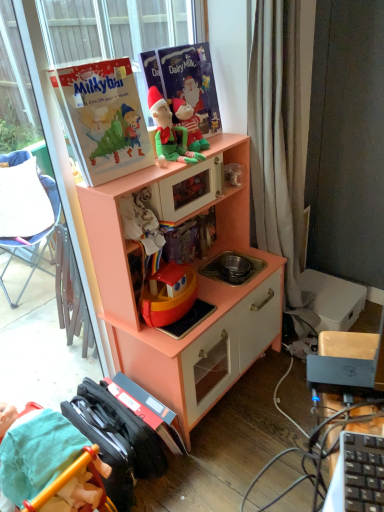
Question: From a real-world perspective, is smooth teal fabric at lower left, the 2th person in the top-to-bottom sequence, over green plush toy at upper center, which is counted as the second person, starting from the left?

Choices:
 (A) no
 (B) yes

Answer: (A)

Question: Can you see smooth teal fabric at lower left, which appears as the 1th person when ordered from the bottom, touching green plush toy at upper center, the 2th person from the bottom?

Choices:
 (A) no
 (B) yes

Answer: (A)

Question: Is smooth teal fabric at lower left, the 2th person viewed from the right, not inside green plush toy at upper center, which is counted as the second person, starting from the left?

Choices:
 (A) yes
 (B) no

Answer: (A)

Question: Is smooth teal fabric at lower left, which appears as the 1th person when ordered from the bottom, facing away from green plush toy at upper center, the 2th person from the bottom?

Choices:
 (A) no
 (B) yes

Answer: (A)

Question: Does smooth teal fabric at lower left, the 2th person in the top-to-bottom sequence, have a larger size compared to green plush toy at upper center, marked as the 1th person in a right-to-left arrangement?

Choices:
 (A) yes
 (B) no

Answer: (A)

Question: Is smooth teal fabric at lower left, which appears as the 1th person when ordered from the bottom, wider than green plush toy at upper center, which is counted as the second person, starting from the left?

Choices:
 (A) no
 (B) yes

Answer: (B)

Question: Is matte paperboard book at upper left, the 2th paperback book from the right, smaller than matte paper book at upper center, which is the second paperback book in left-to-right order?

Choices:
 (A) yes
 (B) no

Answer: (B)

Question: From the image's perspective, does matte paperboard book at upper left, arranged as the 1th paperback book when viewed from the left, appear higher than matte paper book at upper center, which is the second paperback book in left-to-right order?

Choices:
 (A) no
 (B) yes

Answer: (A)

Question: Is matte paperboard book at upper left, the 2th paperback book from the right, positioned in front of matte paper book at upper center, which appears as the 1th paperback book when viewed from the right?

Choices:
 (A) no
 (B) yes

Answer: (B)

Question: Can you confirm if matte paperboard book at upper left, arranged as the 1th paperback book when viewed from the left, is bigger than matte paper book at upper center, which appears as the 1th paperback book when viewed from the right?

Choices:
 (A) yes
 (B) no

Answer: (A)

Question: Is matte paperboard book at upper left, the 2th paperback book from the right, wider than matte paper book at upper center, which is the second paperback book in left-to-right order?

Choices:
 (A) no
 (B) yes

Answer: (B)

Question: Can you confirm if matte paperboard book at upper left, arranged as the 1th paperback book when viewed from the left, is positioned to the right of matte paper book at upper center, which is the second paperback book in left-to-right order?

Choices:
 (A) no
 (B) yes

Answer: (A)

Question: From the image's perspective, is matte paper book at upper center, which appears as the 1th paperback book when viewed from the right, under peach wood toy kitchen at center?

Choices:
 (A) no
 (B) yes

Answer: (A)